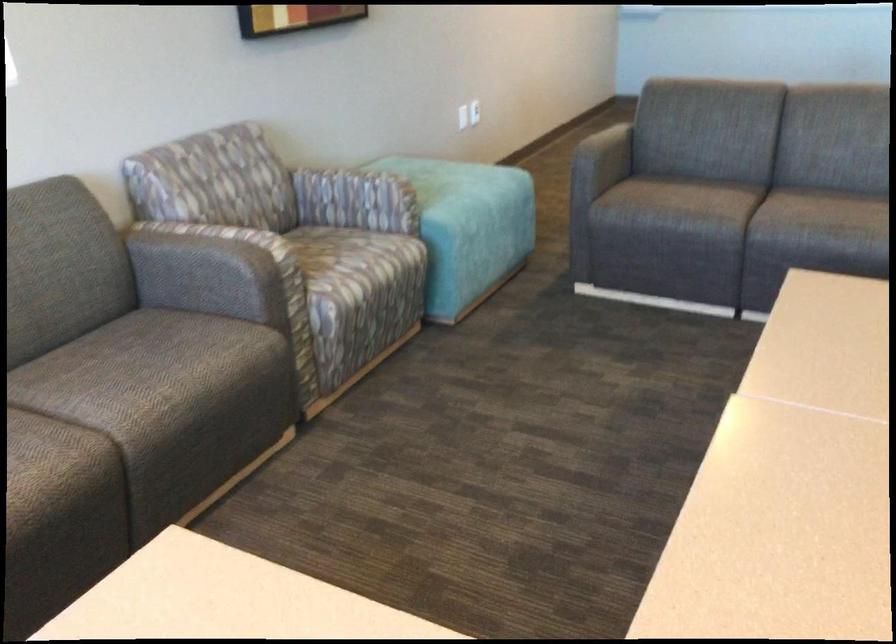
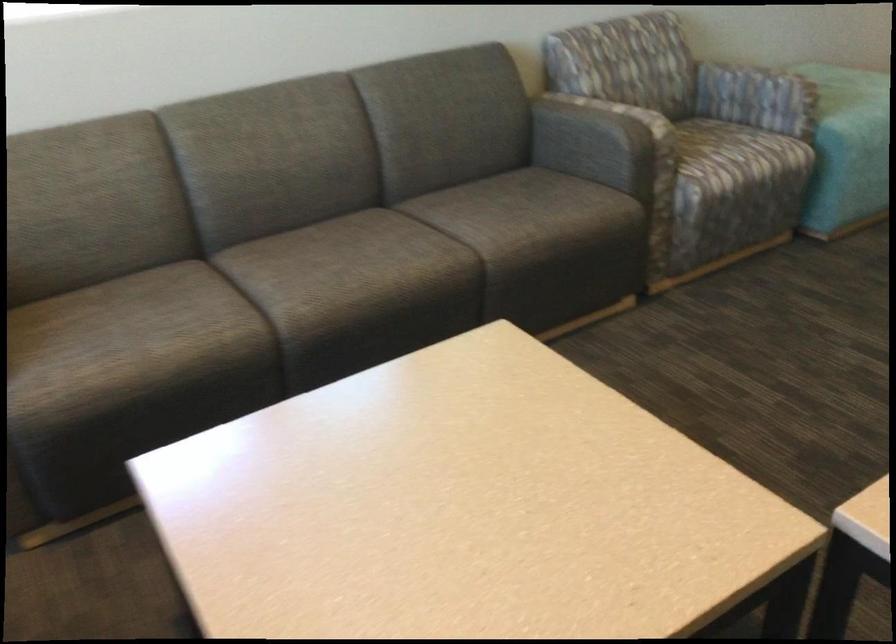
Find the pixel in the second image that matches (453,223) in the first image.

(854, 129)